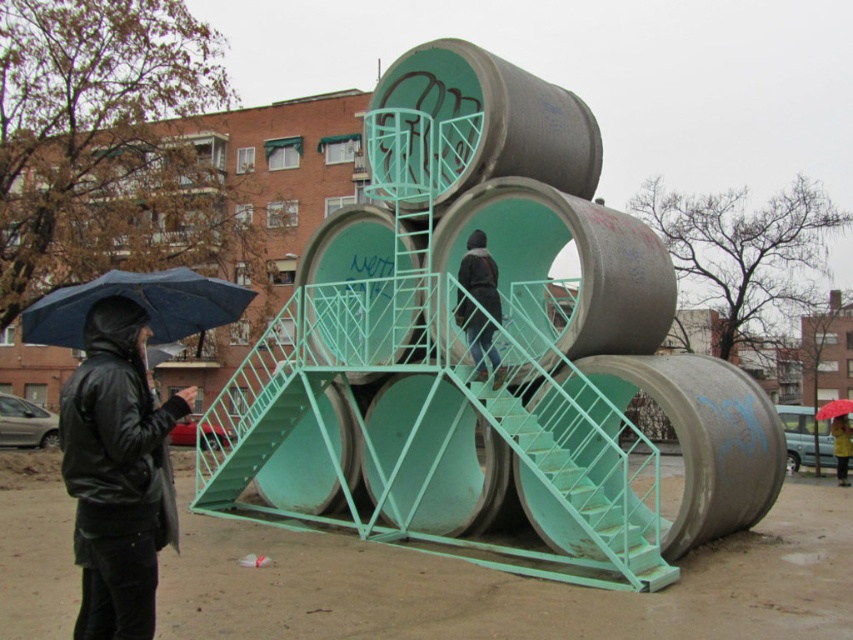
Question: Is green painted metal stairs at center behind dark gray hoodie at center?

Choices:
 (A) yes
 (B) no

Answer: (B)

Question: Among these objects, which one is farthest from the camera?

Choices:
 (A) blue matte umbrella at left
 (B) green painted metal stairs at center

Answer: (B)

Question: Is concrete textured barrel at center behind black leather jacket at left?

Choices:
 (A) yes
 (B) no

Answer: (A)

Question: Which point is farther to the camera?

Choices:
 (A) blue matte umbrella at left
 (B) yellow matte jacket at upper center
 (C) red matte umbrella at upper right

Answer: (C)

Question: Where is blue matte umbrella at left located in relation to green painted metal stairs at center in the image?

Choices:
 (A) above
 (B) below

Answer: (A)

Question: Which of these objects is positioned closest to the black leather jacket at left?

Choices:
 (A) blue matte umbrella at left
 (B) dark gray hoodie at center
 (C) red matte umbrella at upper right

Answer: (A)